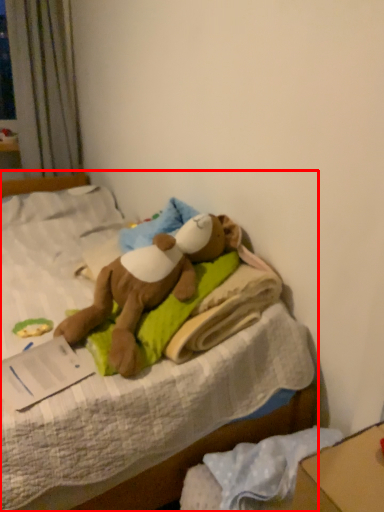
Question: From the image's perspective, what is the correct spatial positioning of bed (annotated by the red box) in reference to toy?

Choices:
 (A) below
 (B) above

Answer: (B)